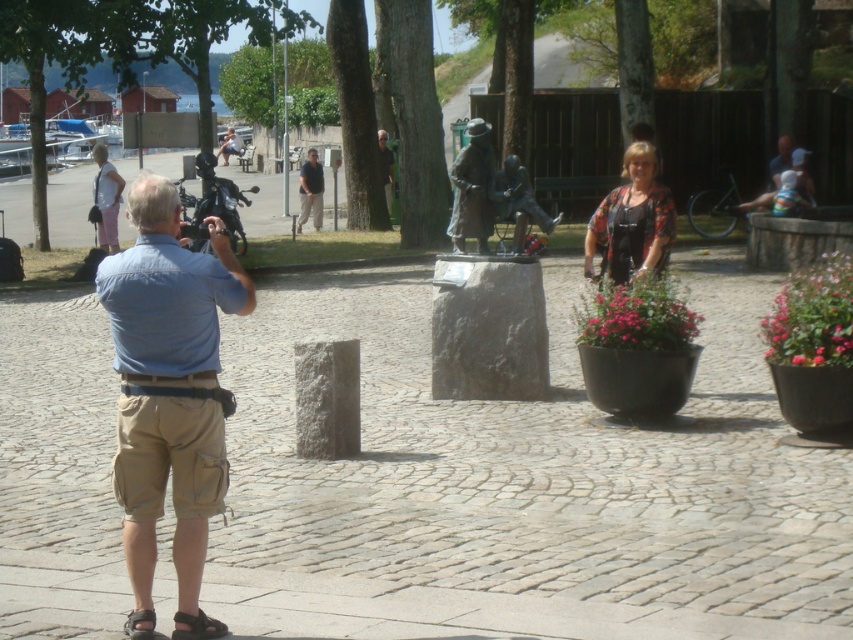
Can you confirm if bronze statue at center is wider than matte black statue at center?

Indeed, bronze statue at center has a greater width compared to matte black statue at center.

Who is more forward, (471,173) or (387,157)?

Point (471,173)

This screenshot has height=640, width=853. I want to click on bronze statue at center, so click(473, 188).

Can you confirm if floral-patterned blouse at center is bigger than bronze statue at center?

Actually, floral-patterned blouse at center might be smaller than bronze statue at center.

Is point (583, 275) in front of point (451, 172)?

No, it is not.

This screenshot has width=853, height=640. Identify the location of floral-patterned blouse at center. (631, 220).

Is bronze statue at center closer to the viewer compared to matte pink dress at left?

Yes, bronze statue at center is closer to the viewer.

Is bronze statue at center smaller than matte pink dress at left?

Actually, bronze statue at center might be larger than matte pink dress at left.

Is point (473, 172) positioned before point (94, 180)?

Yes, it is in front of point (94, 180).

Find the location of a particular element. The height and width of the screenshot is (640, 853). bronze statue at center is located at coordinates (473, 188).